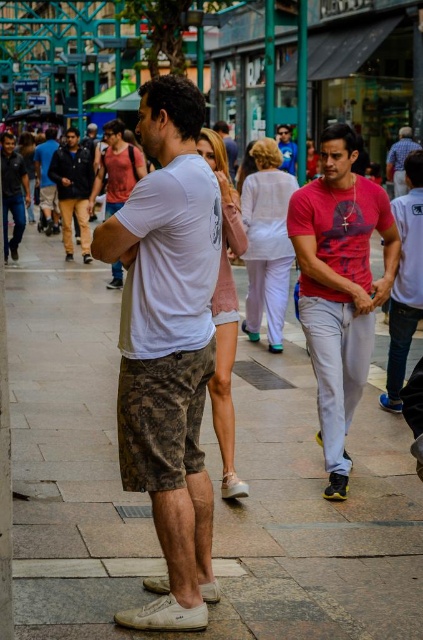
Between point (392, 268) and point (76, 168), which one is positioned behind?

The point (76, 168) is behind.

Is point (324, 189) farther from viewer compared to point (60, 161)?

That is False.

Where is `matte pink t-shirt at center`? This screenshot has height=640, width=423. matte pink t-shirt at center is located at coordinates (340, 285).

Does gray stone pavement at center appear on the left side of white matte t-shirt at center?

Incorrect, gray stone pavement at center is not on the left side of white matte t-shirt at center.

Does gray stone pavement at center have a greater width compared to white matte t-shirt at center?

Indeed, gray stone pavement at center has a greater width compared to white matte t-shirt at center.

Locate an element on the screen. The width and height of the screenshot is (423, 640). gray stone pavement at center is located at coordinates (213, 481).

Where is `gray stone pavement at center`? gray stone pavement at center is located at coordinates (213, 481).

In the scene shown: Does white matte t-shirt at center lie in front of matte pink t-shirt at center?

That is True.

Does white matte t-shirt at center appear under matte pink t-shirt at center?

Yes.

Consider the image. Who is more distant from viewer, (209, 586) or (326, 444)?

Point (326, 444)

Locate an element on the screen. white matte t-shirt at center is located at coordinates (167, 348).